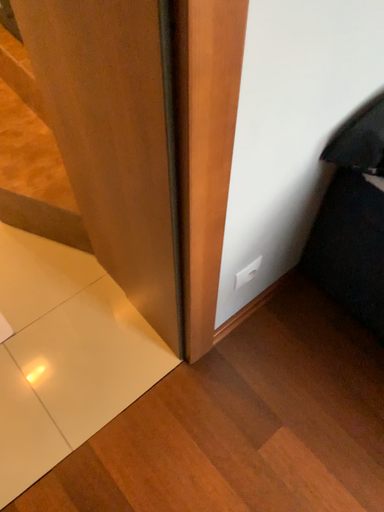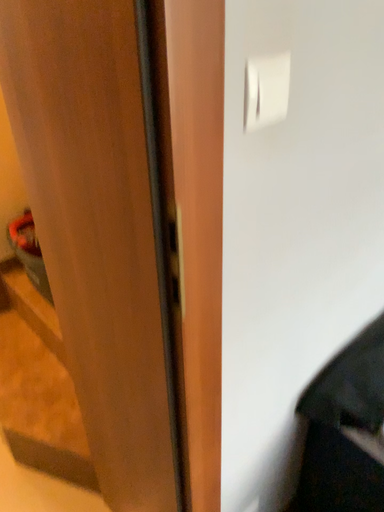
Question: How did the camera likely rotate when shooting the video?

Choices:
 (A) rotated downward
 (B) rotated upward

Answer: (B)